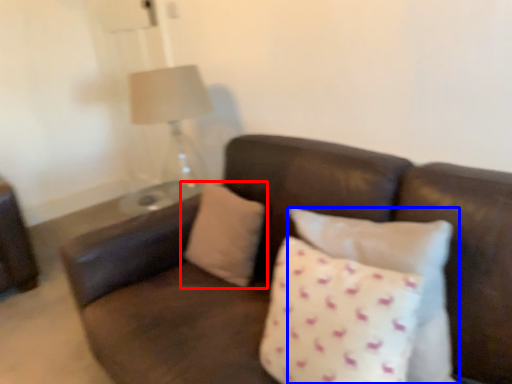
Question: Which object is closer to the camera taking this photo, pillow (highlighted by a red box) or pillow (highlighted by a blue box)?

Choices:
 (A) pillow
 (B) pillow

Answer: (B)